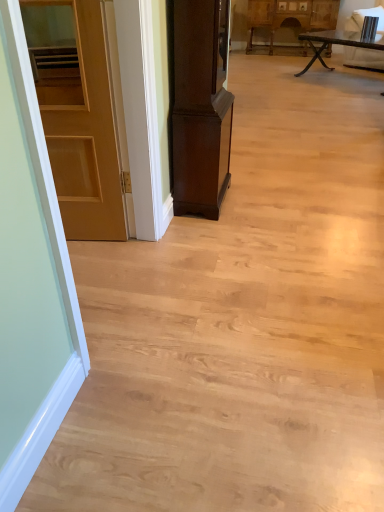
What are the coordinates of `free spot to the right of matte wooden door at left` in the screenshot? It's located at (126, 253).